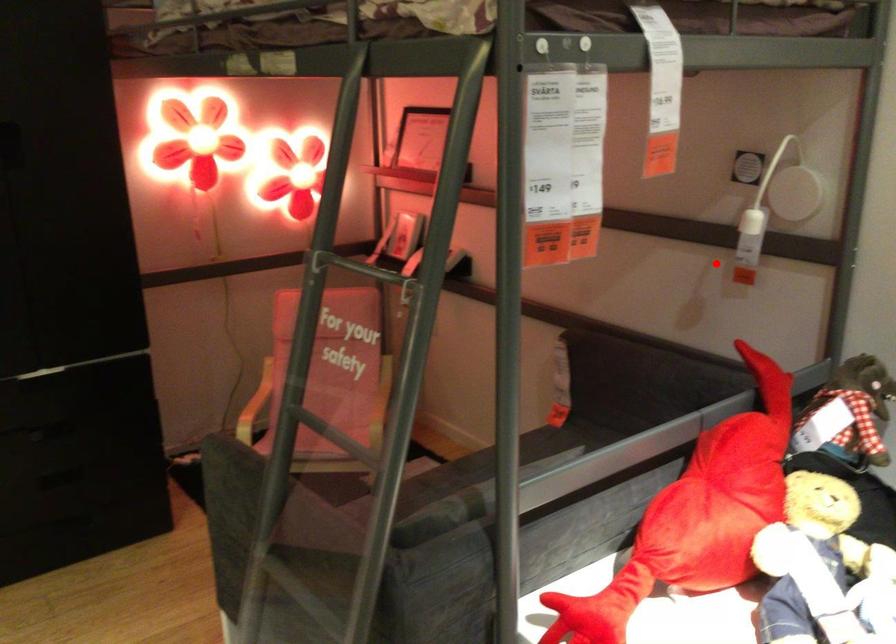
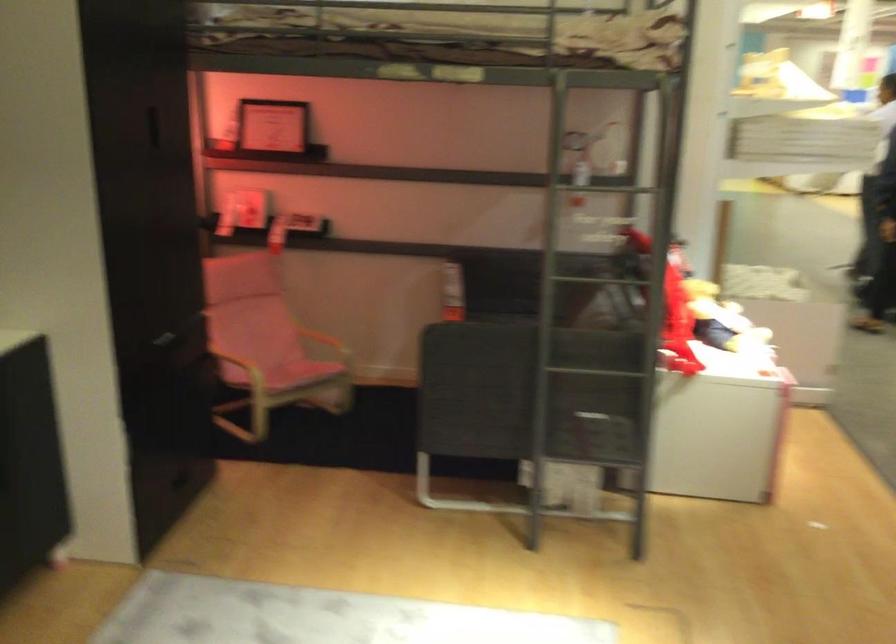
Question: I am providing you with two images of the same scene from different viewpoints. Given a red point in image1, look at the same physical point in image2. Is it:

Choices:
 (A) Closer to the viewpoint
 (B) Farther from the viewpoint

Answer: (B)